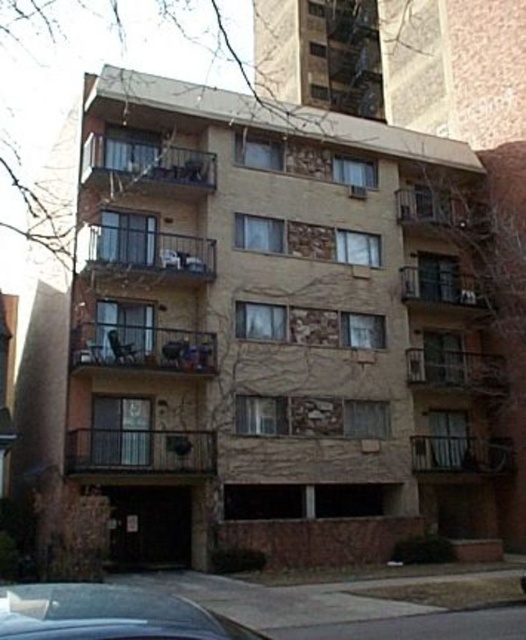
You are a painter who needs to reach the rustic stone balcony at center and the brown stone balcony at upper center to paint them. Which balcony will require a taller ladder?

The brown stone balcony at upper center requires a taller ladder because it is higher up than the rustic stone balcony at center.

You are standing on the sidewalk in front of the residential building and want to take a photo of the brown stone balcony at center and the metallic silver car at center. Which object will appear closer to you in the photo?

The brown stone balcony at center will appear closer to you in the photo because it is further to the viewer than the metallic silver car at center, meaning it is physically nearer to your position on the sidewalk.